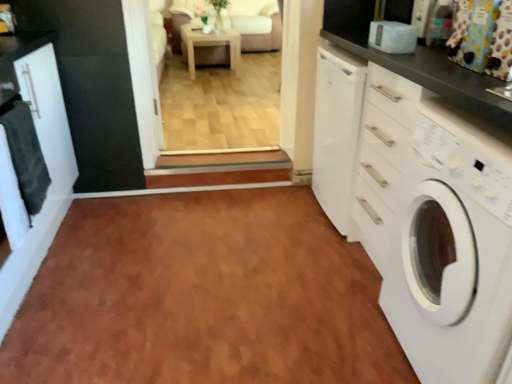
Question: Is dark gray towel at left bigger or smaller than white glossy cabinet at left?

Choices:
 (A) big
 (B) small

Answer: (B)

Question: Considering the positions of dark gray towel at left and white glossy cabinet at left in the image, is dark gray towel at left wider or thinner than white glossy cabinet at left?

Choices:
 (A) wide
 (B) thin

Answer: (B)

Question: Which object is the closest to the light brown wooden table at center?

Choices:
 (A) brown laminate floor at center
 (B) dark gray towel at left
 (C) white glossy cabinet at left
 (D) multicolored fabric curtain at upper right
 (E) white glossy washing machine at right

Answer: (C)

Question: Considering the real-world distances, which object is farthest from the dark gray towel at left?

Choices:
 (A) white glossy washing machine at right
 (B) brown laminate floor at center
 (C) light brown wooden table at center
 (D) white glossy cabinet at left
 (E) multicolored fabric curtain at upper right

Answer: (C)